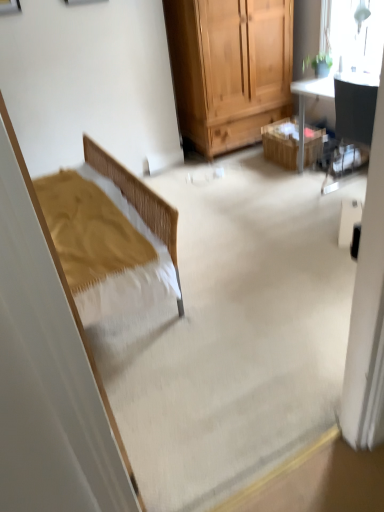
Question: Is matte black chair at upper right wider than wooden picnic basket at center?

Choices:
 (A) yes
 (B) no

Answer: (A)

Question: From a real-world perspective, is matte black chair at upper right below wooden picnic basket at center?

Choices:
 (A) yes
 (B) no

Answer: (B)

Question: Does matte black chair at upper right have a lesser height compared to wooden picnic basket at center?

Choices:
 (A) yes
 (B) no

Answer: (B)

Question: From the image's perspective, is matte black chair at upper right located beneath wooden picnic basket at center?

Choices:
 (A) yes
 (B) no

Answer: (A)

Question: Is matte black chair at upper right beside wooden picnic basket at center?

Choices:
 (A) yes
 (B) no

Answer: (B)

Question: Considering their positions, is matte black chair at upper right located in front of or behind wooden picnic basket at center?

Choices:
 (A) front
 (B) behind

Answer: (A)

Question: From the image's perspective, is matte black chair at upper right located above or below wooden picnic basket at center?

Choices:
 (A) above
 (B) below

Answer: (B)

Question: Visually, is matte black chair at upper right positioned to the left or to the right of wooden picnic basket at center?

Choices:
 (A) left
 (B) right

Answer: (B)

Question: Considering the positions of point (349, 138) and point (294, 160), is point (349, 138) closer or farther from the camera than point (294, 160)?

Choices:
 (A) farther
 (B) closer

Answer: (B)

Question: Is wooden picnic basket at center taller or shorter than transparent glass window at upper right?

Choices:
 (A) tall
 (B) short

Answer: (B)

Question: In terms of width, does wooden picnic basket at center look wider or thinner when compared to transparent glass window at upper right?

Choices:
 (A) wide
 (B) thin

Answer: (A)

Question: Is point (279, 158) closer or farther from the camera than point (349, 40)?

Choices:
 (A) closer
 (B) farther

Answer: (B)

Question: From the image's perspective, is wooden picnic basket at center located above or below transparent glass window at upper right?

Choices:
 (A) above
 (B) below

Answer: (B)

Question: Looking at the image, does matte black chair at upper right seem bigger or smaller compared to transparent glass window at upper right?

Choices:
 (A) small
 (B) big

Answer: (B)

Question: Looking at their shapes, would you say matte black chair at upper right is wider or thinner than transparent glass window at upper right?

Choices:
 (A) thin
 (B) wide

Answer: (B)